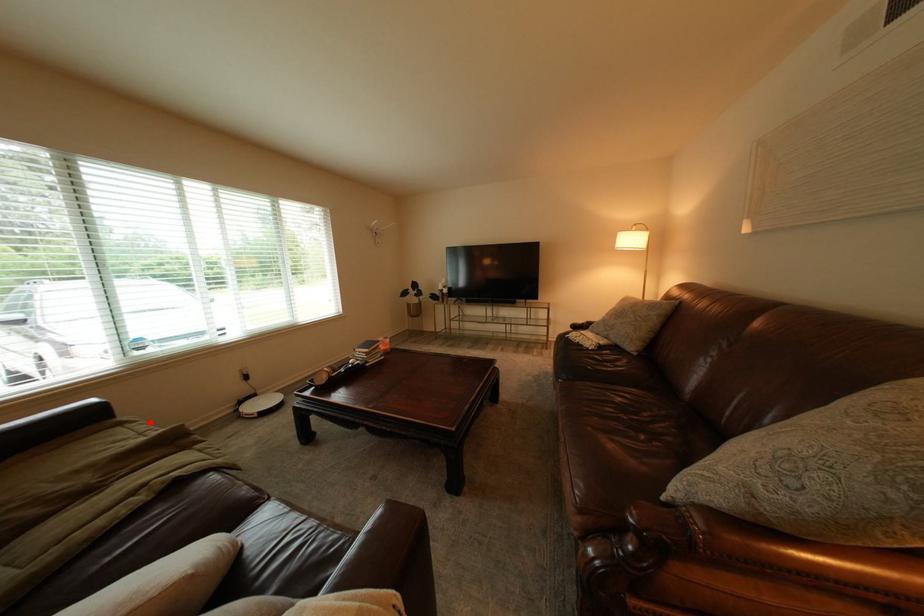
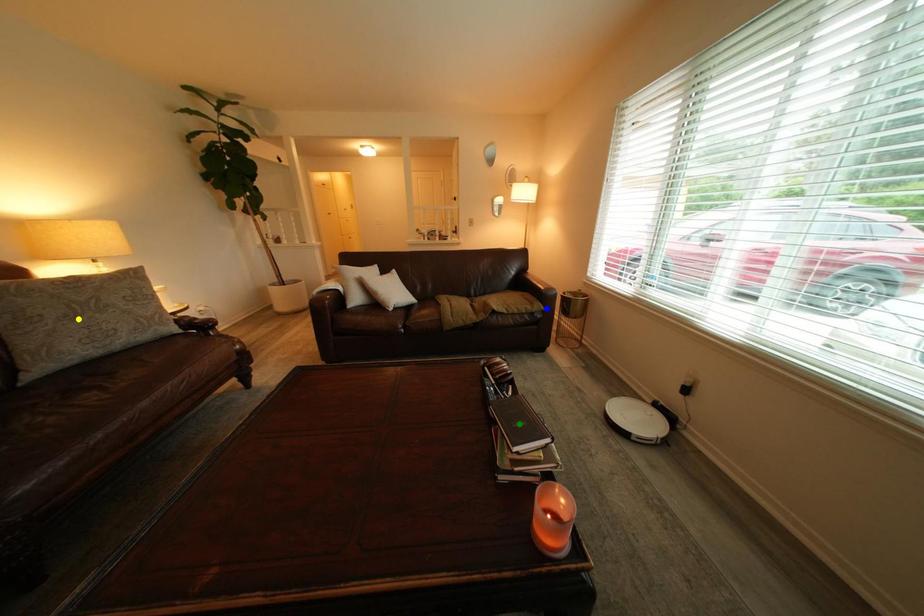
Question: I am providing you with two images of the same scene from different viewpoints. A red point is marked on the first image. You are given multiple points on the second image. Which point in image 2 is actually the same real-world point as the red point in image 1?

Choices:
 (A) blue point
 (B) yellow point
 (C) green point

Answer: (A)